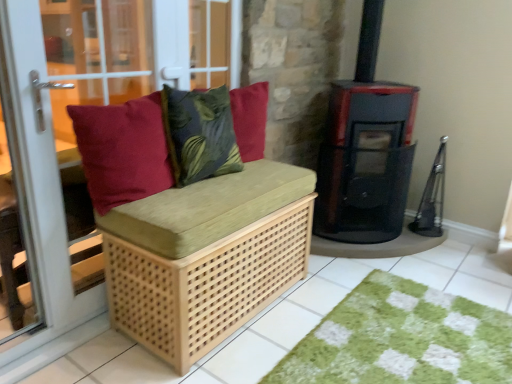
Question: From the image's perspective, is matte red cushion at left on matte wood bench at left?

Choices:
 (A) no
 (B) yes

Answer: (B)

Question: Considering the relative sizes of matte red cushion at left and matte wood bench at left in the image provided, is matte red cushion at left shorter than matte wood bench at left?

Choices:
 (A) yes
 (B) no

Answer: (A)

Question: Considering the relative sizes of matte red cushion at left and matte wood bench at left in the image provided, is matte red cushion at left thinner than matte wood bench at left?

Choices:
 (A) no
 (B) yes

Answer: (A)

Question: Is matte red cushion at left touching matte wood bench at left?

Choices:
 (A) yes
 (B) no

Answer: (B)

Question: From the image's perspective, is matte red cushion at left located beneath matte wood bench at left?

Choices:
 (A) yes
 (B) no

Answer: (B)

Question: Considering the relative sizes of matte red cushion at left and matte wood bench at left in the image provided, is matte red cushion at left bigger than matte wood bench at left?

Choices:
 (A) no
 (B) yes

Answer: (A)

Question: Is natural wood bench cushion at center wider than matte wood bench at left?

Choices:
 (A) no
 (B) yes

Answer: (B)

Question: Does natural wood bench cushion at center have a greater height compared to matte wood bench at left?

Choices:
 (A) yes
 (B) no

Answer: (B)

Question: Is the depth of natural wood bench cushion at center less than that of matte wood bench at left?

Choices:
 (A) yes
 (B) no

Answer: (B)

Question: Does natural wood bench cushion at center appear on the left side of matte wood bench at left?

Choices:
 (A) no
 (B) yes

Answer: (A)

Question: From the image's perspective, is natural wood bench cushion at center above matte wood bench at left?

Choices:
 (A) no
 (B) yes

Answer: (A)

Question: Can you confirm if natural wood bench cushion at center is shorter than matte wood bench at left?

Choices:
 (A) no
 (B) yes

Answer: (B)

Question: Can we say black matte stove at center right lies outside natural wood bench at left?

Choices:
 (A) yes
 (B) no

Answer: (A)